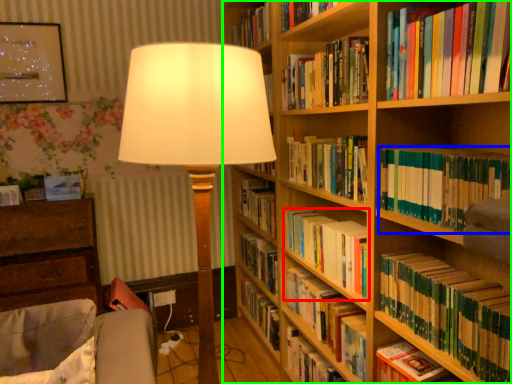
Question: Which object is the closest to the book (highlighted by a red box)? Choose among these: book (highlighted by a blue box) or bookcase (highlighted by a green box).

Choices:
 (A) book
 (B) bookcase

Answer: (B)